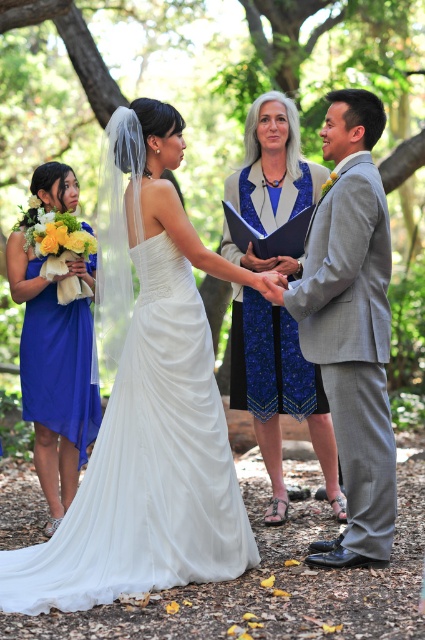
Can you confirm if white satin dress at center is positioned above blue textured dress at center?

No, white satin dress at center is not above blue textured dress at center.

Is point (227, 472) positioned in front of point (280, 115)?

That is True.

The image size is (425, 640). Identify the location of white satin dress at center. tap(147, 467).

Who is more distant from viewer, [394,477] or [34,321]?

The point [34,321] is more distant.

Between point (337, 344) and point (25, 362), which one is positioned in front?

Point (337, 344) is in front.

Identify the location of gray textured suit at right. (351, 324).

Between point (186, 413) and point (34, 339), which one is positioned in front?

Point (186, 413) is in front.

Does white satin dress at center appear under royal blue satin dress at lower left?

Yes, white satin dress at center is below royal blue satin dress at lower left.

Which is in front, point (118, 508) or point (20, 269)?

Point (118, 508) is in front.

The image size is (425, 640). I want to click on white satin dress at center, so click(x=147, y=467).